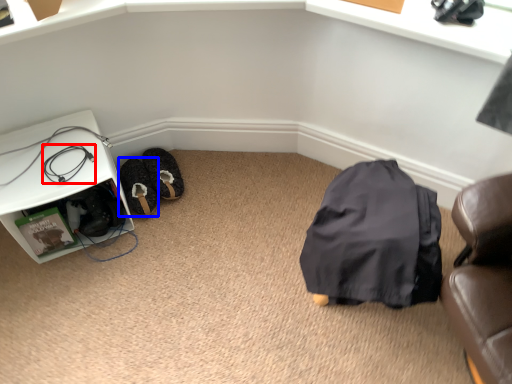
Question: Which of the following is the farthest to the observer, wire (highlighted by a red box) or shoe (highlighted by a blue box)?

Choices:
 (A) wire
 (B) shoe

Answer: (B)